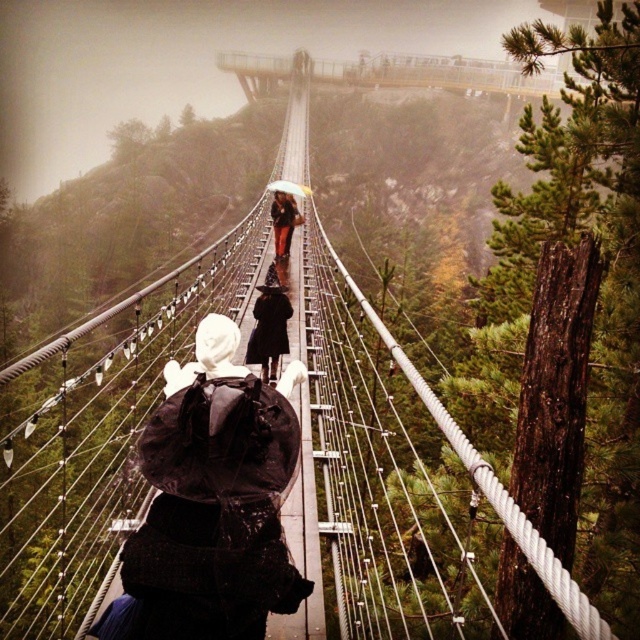
Question: Estimate the real-world distances between objects in this image. Which object is closer to the metallic gray bridge at upper center?

Choices:
 (A) black matte coat at center
 (B) white matte umbrella at center

Answer: (B)

Question: Based on their relative distances, which object is farther from the dark brown leather jacket at center?

Choices:
 (A) metallic gray bridge at upper center
 (B) white matte umbrella at center

Answer: (A)

Question: Does black matte coat at center appear over white matte umbrella at center?

Choices:
 (A) no
 (B) yes

Answer: (A)

Question: Is black matte coat at center above dark brown leather jacket at center?

Choices:
 (A) no
 (B) yes

Answer: (A)

Question: Which point is closer to the camera?

Choices:
 (A) black matte coat at center
 (B) dark brown leather jacket at center
 (C) white matte umbrella at center

Answer: (A)

Question: Is metallic gray bridge at upper center thinner than dark brown leather jacket at center?

Choices:
 (A) no
 (B) yes

Answer: (A)